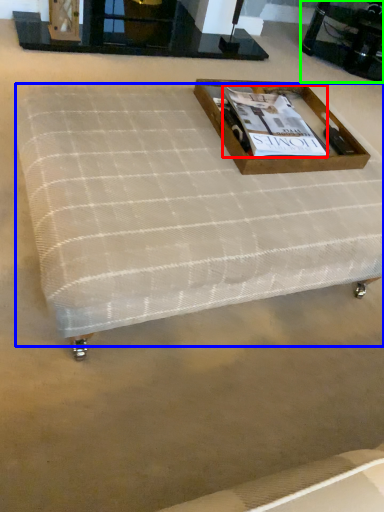
Question: Which object is positioned farthest from magazine (highlighted by a red box)? Select from mattress (highlighted by a blue box) and round table (highlighted by a green box).

Choices:
 (A) mattress
 (B) round table

Answer: (B)